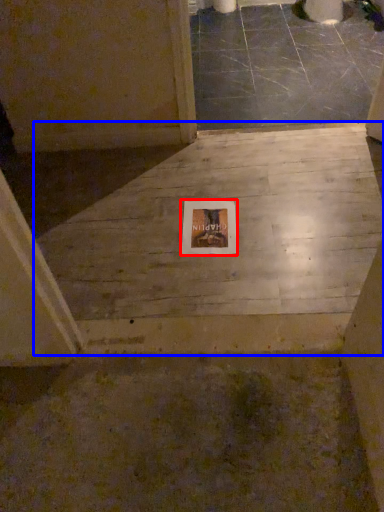
Question: Among these objects, which one is nearest to the camera, picture frame (highlighted by a red box) or concrete (highlighted by a blue box)?

Choices:
 (A) picture frame
 (B) concrete

Answer: (B)